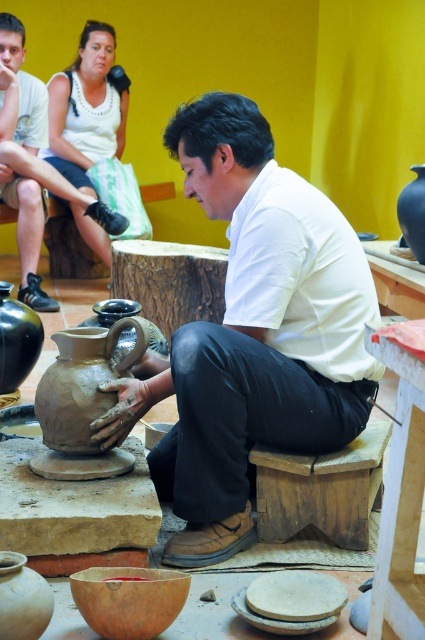
You are a photographer standing at a certain distance from the matte clay potter at center. You want to capture a closeup shot of the potter without using a zoom lens. Based on the scene description, what is the minimum distance you need to move closer to the potter to achieve this?

The matte clay potter at center is 2.34 meters away from the camera. To capture a closeup shot without zoom, you need to move closer to the potter. The minimum distance you should be from the potter is less than 2.34 meters, so you need to move closer by at least 0.34 meters to ensure the subject fills the frame appropriately.

You are a customer in the pottery workshop and want to choose between the matte clay pot at center and the matte black vase at left. Which one is taller?

The matte clay pot at center is taller than the matte black vase at left according to the description.

Consider the image. You are a visitor in the pottery workshop and need to sit down. There is a wooden stool at center and a matte clay pot at lower left. Which one is wider so you can choose the wider one to sit on?

The wooden stool at center is wider than the matte clay pot at lower left, so you should choose the wooden stool at center to sit on.